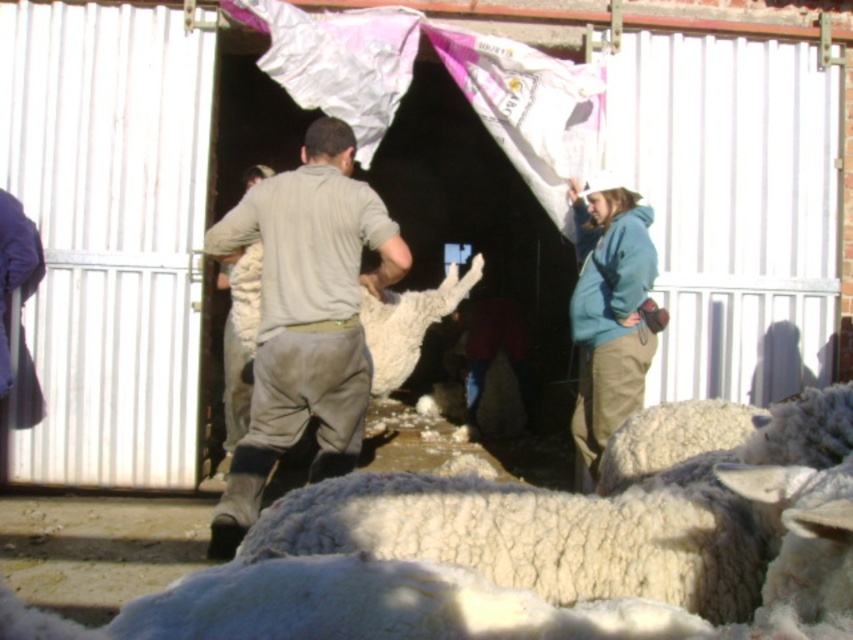
In the scene shown: You are a farmer who needs to collect the wool from the white woolen sheep at center and the white fluffy wool at center. Which one is closer to your current position if you are standing at the left side of the scene?

The white fluffy wool at center is closer to your current position because the white woolen sheep at center is to the right of it.

You are a photographer trying to capture a clear shot of the gray cotton shirt at center and the white fluffy wool at center. Which object will appear larger in your photo?

The gray cotton shirt at center will appear larger in the photo because it is closer to the viewer than the white fluffy wool at center.